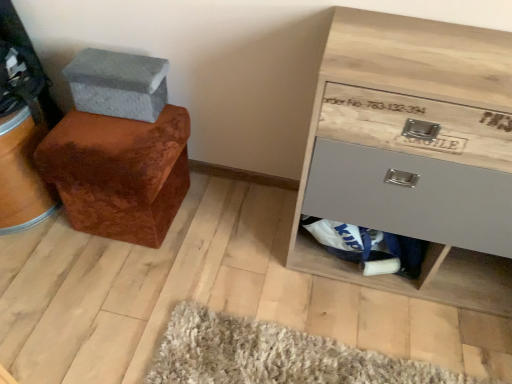
What are the coordinates of `free space that is in between wooden chest of drawers at lower right and velvet brown ottoman at left` in the screenshot? It's located at (248, 230).